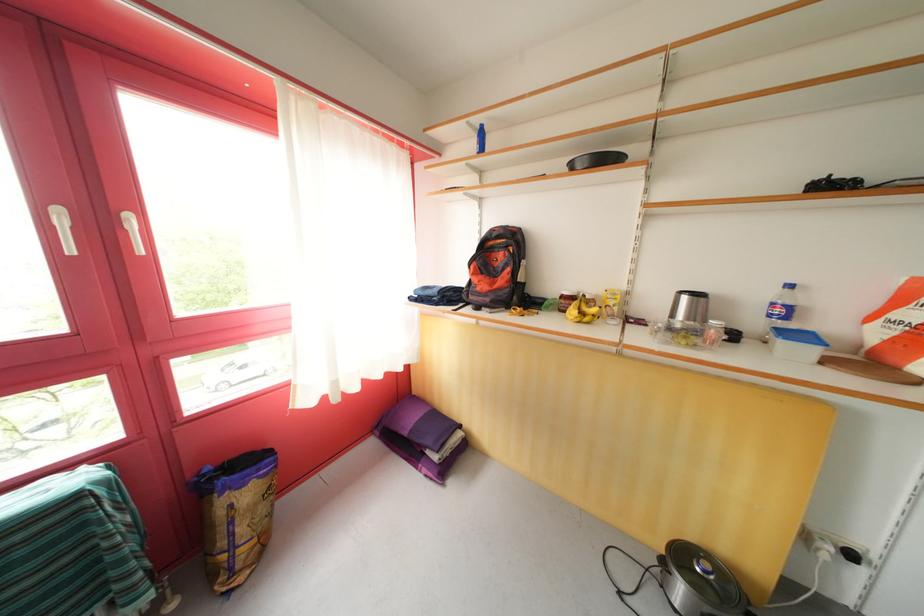
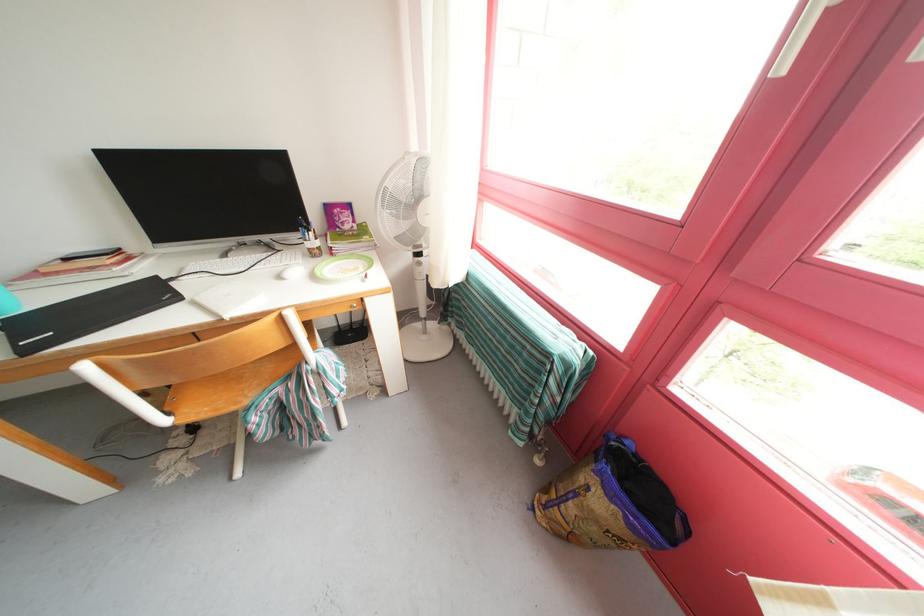
The point at (238, 528) is marked in the first image. Where is the corresponding point in the second image?

(582, 499)